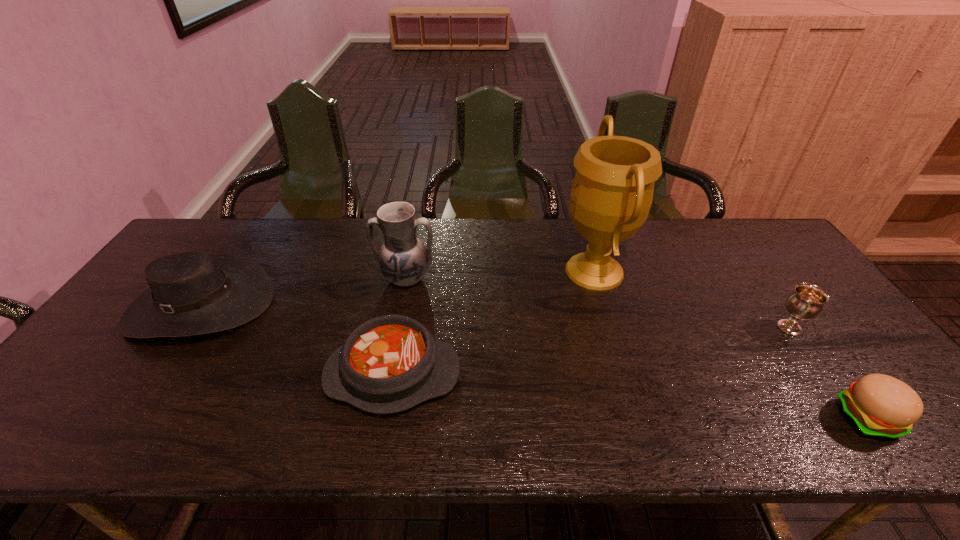
This screenshot has height=540, width=960. In order to click on trophy in this screenshot , I will do `click(611, 195)`.

Identify the location of the fourth object from left to right. Image resolution: width=960 pixels, height=540 pixels. (611, 195).

Locate an element on the screen. This screenshot has height=540, width=960. the fifth shortest object is located at coordinates (403, 259).

The height and width of the screenshot is (540, 960). Identify the location of the leftmost object. (192, 293).

The height and width of the screenshot is (540, 960). In order to click on cowboy hat in this screenshot , I will do `click(192, 293)`.

In order to click on chalice in this screenshot , I will do `click(807, 301)`.

Identify the location of casserole. (391, 363).

This screenshot has width=960, height=540. Identify the location of hamburger. (881, 406).

At what (x,y) coordinates should I click in order to perform the action: click on vacant space situated on the engravings side of the trophy. Please return your answer as a coordinate pair (x, y). This screenshot has width=960, height=540. Looking at the image, I should click on (427, 271).

The height and width of the screenshot is (540, 960). I want to click on free region located on the engravings side of the trophy, so click(x=490, y=271).